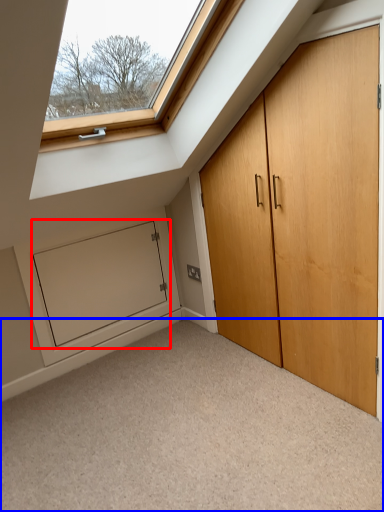
Question: Which object appears closest to the camera in this image, screen door (highlighted by a red box) or corridor (highlighted by a blue box)?

Choices:
 (A) screen door
 (B) corridor

Answer: (B)